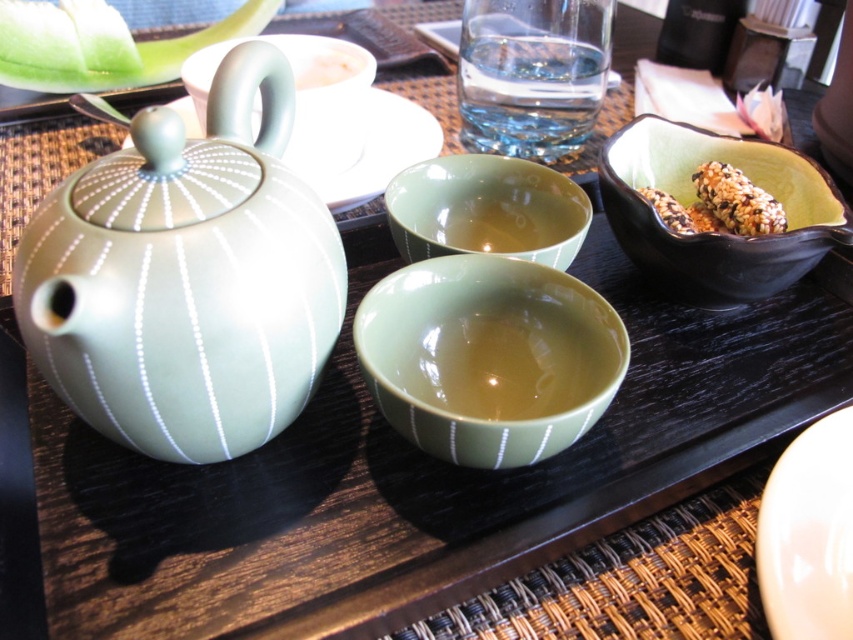
Question: Does sandy brown textured snack at right have a smaller size compared to white creamy rice at center?

Choices:
 (A) no
 (B) yes

Answer: (A)

Question: Which of these objects is positioned farthest from the matte ceramic teapot at upper left?

Choices:
 (A) matte ceramic plate at upper center
 (B) green glossy bowl at center
 (C) matte green bowl at center
 (D) black glossy bowl at upper right

Answer: (D)

Question: Which of the following is the farthest from the observer?

Choices:
 (A) white glossy plate at lower right
 (B) sandy brown rice ball at right

Answer: (B)

Question: Is black glossy bowl at upper right below white creamy rice at center?

Choices:
 (A) yes
 (B) no

Answer: (A)

Question: Which of the following is the farthest from the observer?

Choices:
 (A) sandy brown textured snack at right
 (B) white creamy rice at center
 (C) green glossy bowl at center
 (D) matte ceramic teapot at upper left

Answer: (B)

Question: Is satin green teapot at left to the left of matte ceramic teapot at upper left from the viewer's perspective?

Choices:
 (A) no
 (B) yes

Answer: (A)